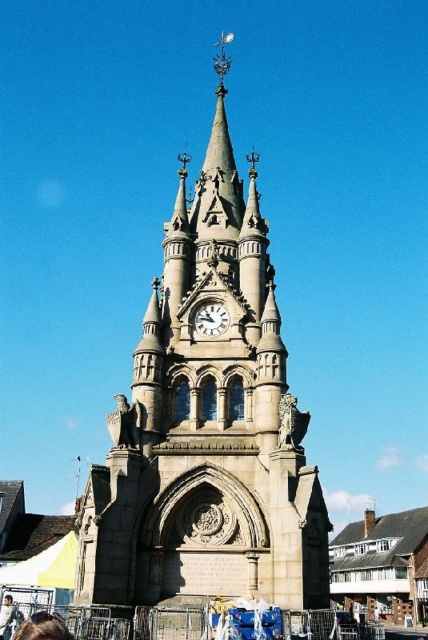
You are standing in a square and see the stone clock tower at center and the light brown leather jacket at lower left. Which object is positioned to the right of the other?

The stone clock tower at center is positioned to the right of the light brown leather jacket at lower left.

You are a photographer standing in front of the stone clock tower and want to take a picture of the brown hair at lower left and the light brown leather jacket at lower left. Which object should you focus on first if you want to capture both in the same frame without moving the camera?

The light brown leather jacket at lower left should be focused on first because it is shorter than the brown hair at lower left, allowing the camera to capture both in the same frame by adjusting focus from near to far.